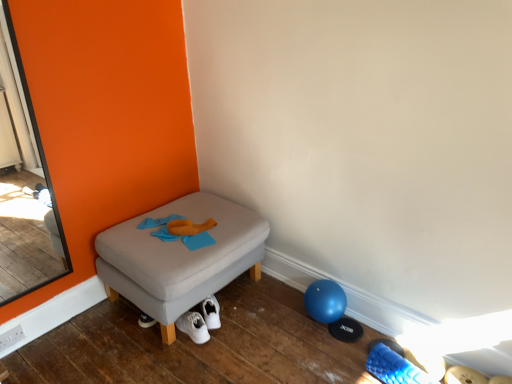
Find the location of `white fabric shoe at lower center`. white fabric shoe at lower center is located at coordinates (394, 367).

Image resolution: width=512 pixels, height=384 pixels. Find the location of `clear glass screen door at left`. clear glass screen door at left is located at coordinates (21, 181).

Identify the location of matte gray ottoman at center. (179, 258).

Who is smaller, matte gray ottoman at center or clear glass screen door at left?

clear glass screen door at left is smaller.

Does point (193, 251) appear closer or farther from the camera than point (34, 255)?

Point (193, 251).

Is matte gray ottoman at center placed right next to clear glass screen door at left?

No, matte gray ottoman at center is not in contact with clear glass screen door at left.

Is matte gray ottoman at center oriented away from white fabric shoe at lower center?

No, white fabric shoe at lower center is not at the back of matte gray ottoman at center.

Between matte gray ottoman at center and white fabric shoe at lower center, which one has less height?

Standing shorter between the two is white fabric shoe at lower center.

From the picture: From a real-world perspective, who is located lower, matte gray ottoman at center or white fabric shoe at lower center?

In real-world perspective, white fabric shoe at lower center is lower.

From the image's perspective, which is below, matte gray ottoman at center or white fabric shoe at lower center?

From the image's view, white fabric shoe at lower center is below.

Looking at this image, from a real-world perspective, is clear glass screen door at left positioned over white fabric shoe at lower center based on gravity?

Yes, from a real-world perspective, clear glass screen door at left is on top of white fabric shoe at lower center.

Considering the sizes of clear glass screen door at left and white fabric shoe at lower center in the image, is clear glass screen door at left taller or shorter than white fabric shoe at lower center?

Clearly, clear glass screen door at left is taller compared to white fabric shoe at lower center.

Where is `screen door in front of the white fabric shoe at lower center`? screen door in front of the white fabric shoe at lower center is located at coordinates (21, 181).

Is clear glass screen door at left not within white fabric shoe at lower center?

That's correct, clear glass screen door at left is outside of white fabric shoe at lower center.

Does white fabric shoe at lower center have a lesser width compared to clear glass screen door at left?

In fact, white fabric shoe at lower center might be wider than clear glass screen door at left.

In the scene shown: From a real-world perspective, is white fabric shoe at lower center positioned over clear glass screen door at left based on gravity?

Incorrect, from a real-world perspective, white fabric shoe at lower center is lower than clear glass screen door at left.

From the image's perspective, is white fabric shoe at lower center above or below clear glass screen door at left?

white fabric shoe at lower center is below clear glass screen door at left.

How much distance is there between white fabric shoe at lower center and clear glass screen door at left?

white fabric shoe at lower center is 6.37 feet from clear glass screen door at left.

Does white fabric shoe at lower center have a greater height compared to matte gray ottoman at center?

No.

Is white fabric shoe at lower center to the right of matte gray ottoman at center from the viewer's perspective?

Correct, you'll find white fabric shoe at lower center to the right of matte gray ottoman at center.

Can you tell me how much white fabric shoe at lower center and matte gray ottoman at center differ in facing direction?

white fabric shoe at lower center and matte gray ottoman at center are facing 101 degrees away from each other.

This screenshot has height=384, width=512. What are the coordinates of `footwear located below the matte gray ottoman at center (from the image's perspective)` in the screenshot? It's located at (394, 367).

From a real-world perspective, does clear glass screen door at left sit lower than matte gray ottoman at center?

Incorrect, from a real-world perspective, clear glass screen door at left is higher than matte gray ottoman at center.

Is clear glass screen door at left turned away from matte gray ottoman at center?

No, clear glass screen door at left is not facing the opposite direction of matte gray ottoman at center.

Which object is wider, clear glass screen door at left or matte gray ottoman at center?

Wider between the two is matte gray ottoman at center.

Based on the photo, which object is positioned more to the left, clear glass screen door at left or matte gray ottoman at center?

Positioned to the left is clear glass screen door at left.

Image resolution: width=512 pixels, height=384 pixels. I want to click on screen door above the matte gray ottoman at center (from the image's perspective), so click(21, 181).

Locate an element on the screen. footwear below the matte gray ottoman at center (from the image's perspective) is located at coordinates coord(394,367).

From the image, which object appears to be nearer to clear glass screen door at left, matte gray ottoman at center or white fabric shoe at lower center?

Based on the image, matte gray ottoman at center appears to be nearer to clear glass screen door at left.

Estimate the real-world distances between objects in this image. Which object is closer to matte gray ottoman at center, clear glass screen door at left or white fabric shoe at lower center?

clear glass screen door at left.

Looking at the image, which one is located closer to white fabric shoe at lower center, clear glass screen door at left or matte gray ottoman at center?

Based on the image, matte gray ottoman at center appears to be nearer to white fabric shoe at lower center.

Looking at the image, which one is located further to clear glass screen door at left, white fabric shoe at lower center or matte gray ottoman at center?

white fabric shoe at lower center is positioned further to the anchor clear glass screen door at left.

Looking at the image, which one is located closer to matte gray ottoman at center, white fabric shoe at lower center or clear glass screen door at left?

Based on the image, clear glass screen door at left appears to be nearer to matte gray ottoman at center.

When comparing their distances from white fabric shoe at lower center, does matte gray ottoman at center or clear glass screen door at left seem further?

clear glass screen door at left lies further to white fabric shoe at lower center than the other object.

Find the location of a particular element. furniture situated between clear glass screen door at left and white fabric shoe at lower center from left to right is located at coordinates (179, 258).